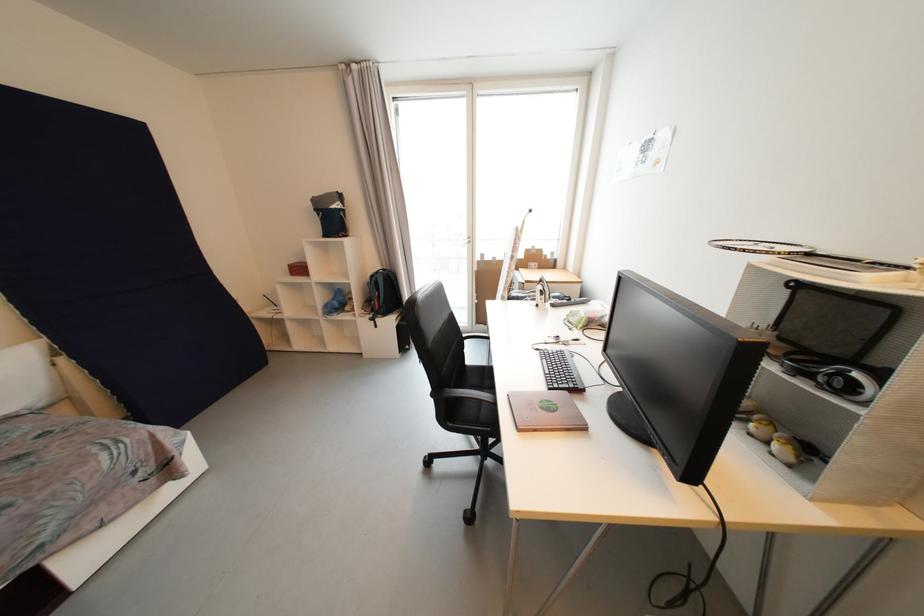
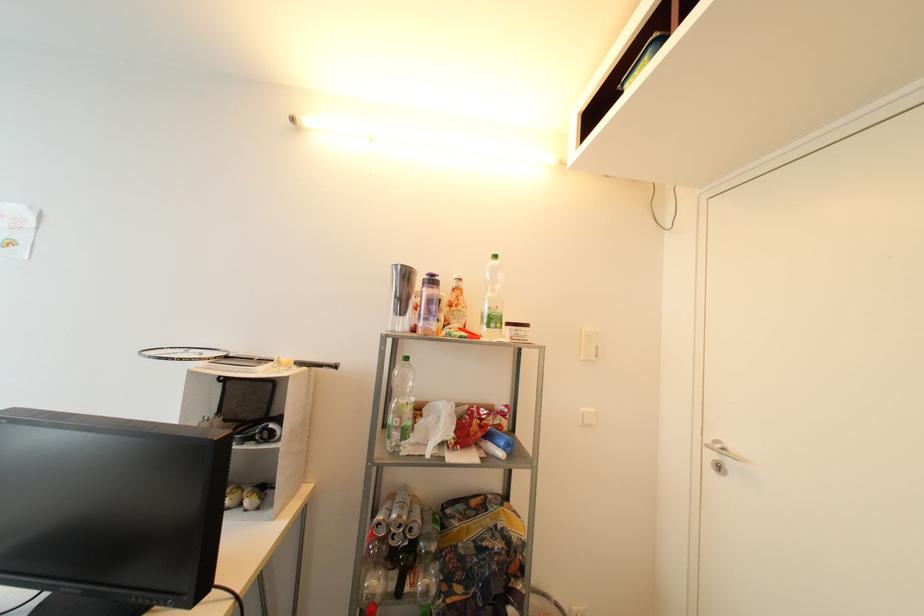
In the second image, find the point that corresponds to point (813, 256) in the first image.

(232, 359)